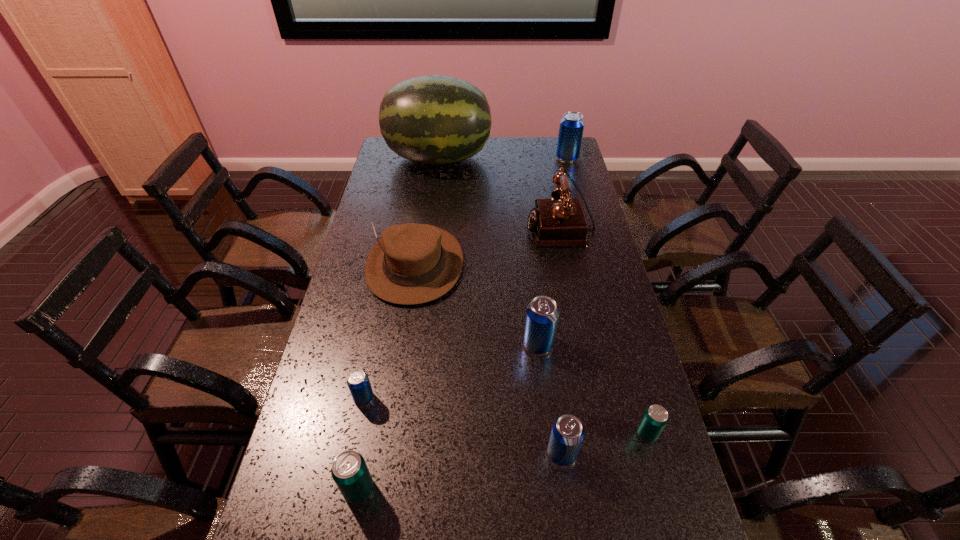
At what (x,y) coordinates should I click in order to perform the action: click on blue beer can that stands as the closest to the smaller teal beer can. Please return your answer as a coordinate pair (x, y). Looking at the image, I should click on (567, 433).

This screenshot has width=960, height=540. What are the coordinates of `vacant space that satisfies the following two spatial constraints: 1. on the front side of the green watermelon; 2. on the left side of the smaller teal beer can` in the screenshot? It's located at (403, 434).

This screenshot has width=960, height=540. What are the coordinates of `vacant point that satisfies the following two spatial constraints: 1. on the front side of the farther teal beer can; 2. on the right side of the watermelon` in the screenshot? It's located at (403, 434).